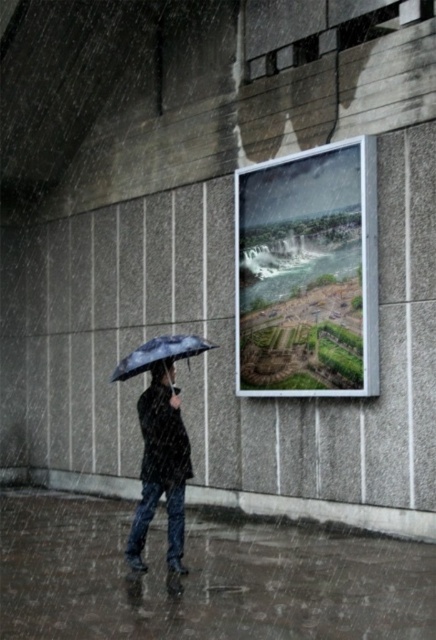
Question: Can you confirm if dark blue matte umbrella at center is positioned to the right of matte black umbrella at center?

Choices:
 (A) no
 (B) yes

Answer: (A)

Question: Observing the image, what is the correct spatial positioning of dark blue matte umbrella at center in reference to matte black umbrella at center?

Choices:
 (A) below
 (B) above

Answer: (A)

Question: Among these points, which one is nearest to the camera?

Choices:
 (A) (191, 349)
 (B) (160, 390)

Answer: (B)

Question: Can you confirm if dark blue matte umbrella at center is wider than matte black umbrella at center?

Choices:
 (A) no
 (B) yes

Answer: (A)

Question: Which point is closer to the camera?

Choices:
 (A) matte black umbrella at center
 (B) dark blue matte umbrella at center

Answer: (B)